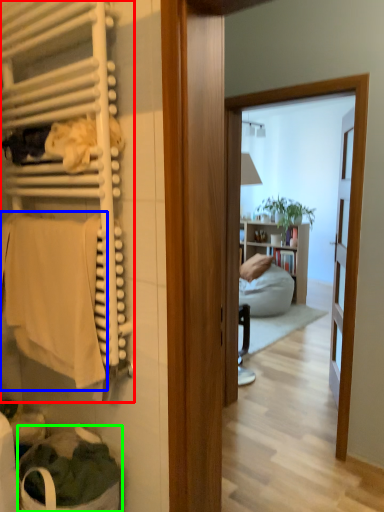
Question: Which object is the farthest from closet (highlighted by a red box)? Choose among these: bath towel (highlighted by a blue box) or laundry basket (highlighted by a green box).

Choices:
 (A) bath towel
 (B) laundry basket

Answer: (B)